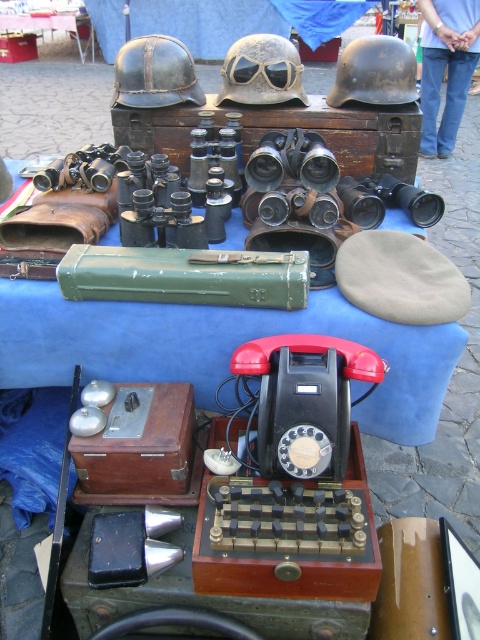
Question: Which object appears closest to the camera in this image?

Choices:
 (A) camouflage fabric helmet at center
 (B) matte brown helmet at center

Answer: (B)

Question: Considering the relative positions of green leather case at upper center and matte black helmet at upper left in the image provided, where is green leather case at upper center located with respect to matte black helmet at upper left?

Choices:
 (A) right
 (B) left

Answer: (A)

Question: Which object is farther from the camera taking this photo?

Choices:
 (A) green leather case at upper center
 (B) matte brown helmet at center

Answer: (B)

Question: Does matte black helmet at upper left appear on the right side of matte brown helmet at center?

Choices:
 (A) yes
 (B) no

Answer: (B)

Question: Estimate the real-world distances between objects in this image. Which object is farther from the matte black helmet at upper left?

Choices:
 (A) metallic matte goggles at center
 (B) camouflage fabric helmet at center

Answer: (A)

Question: Where is matte black helmet at upper left located in relation to camouflage fabric helmet at center in the image?

Choices:
 (A) left
 (B) right

Answer: (A)